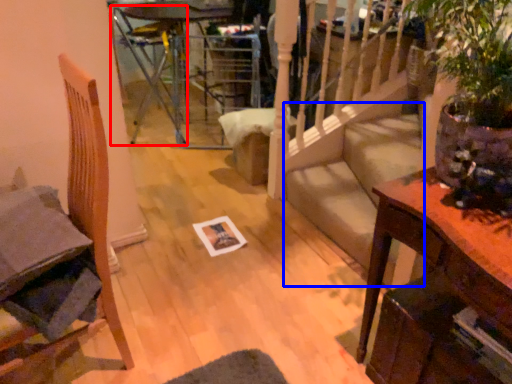
Question: Which of the following is the closest to the observer, armchair (highlighted by a red box) or stairwell (highlighted by a blue box)?

Choices:
 (A) armchair
 (B) stairwell

Answer: (B)